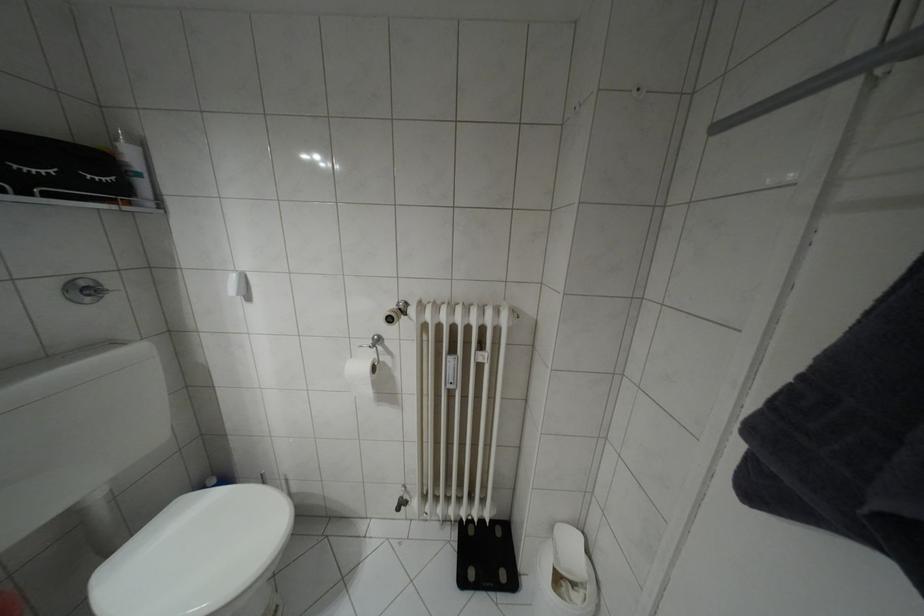
Find where to pull the toilet paper roll. Please return your answer as a coordinate pair (x, y).

(359, 376)